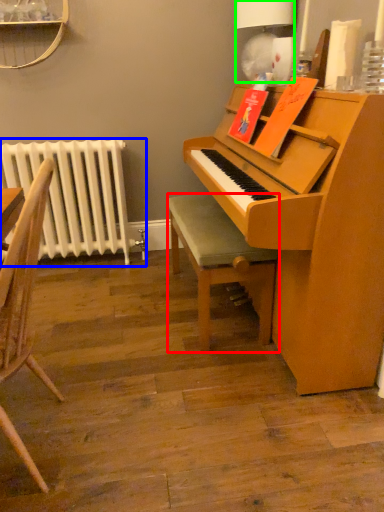
Question: Which is nearer to the stool (highlighted by a red box)? radiator (highlighted by a blue box) or lamp (highlighted by a green box).

Choices:
 (A) radiator
 (B) lamp

Answer: (A)